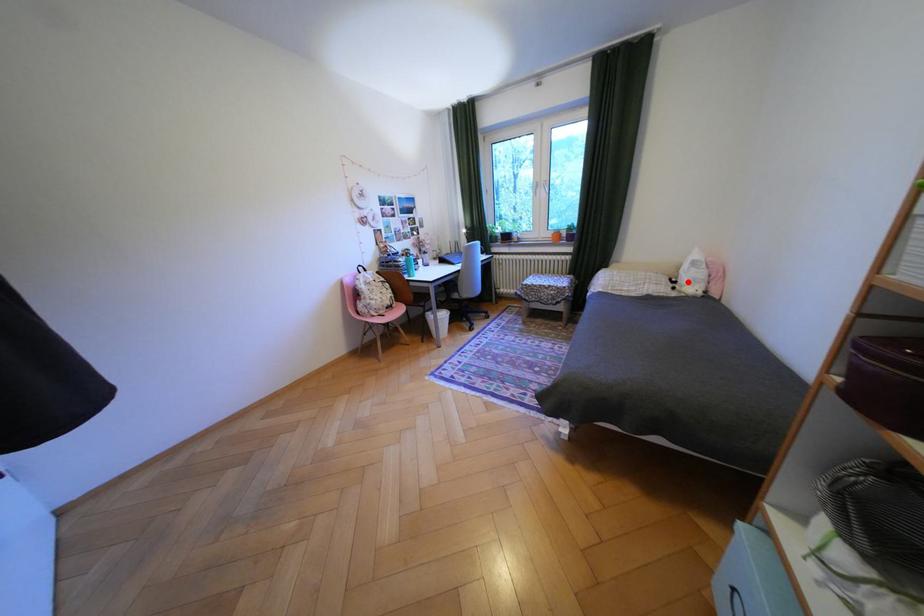
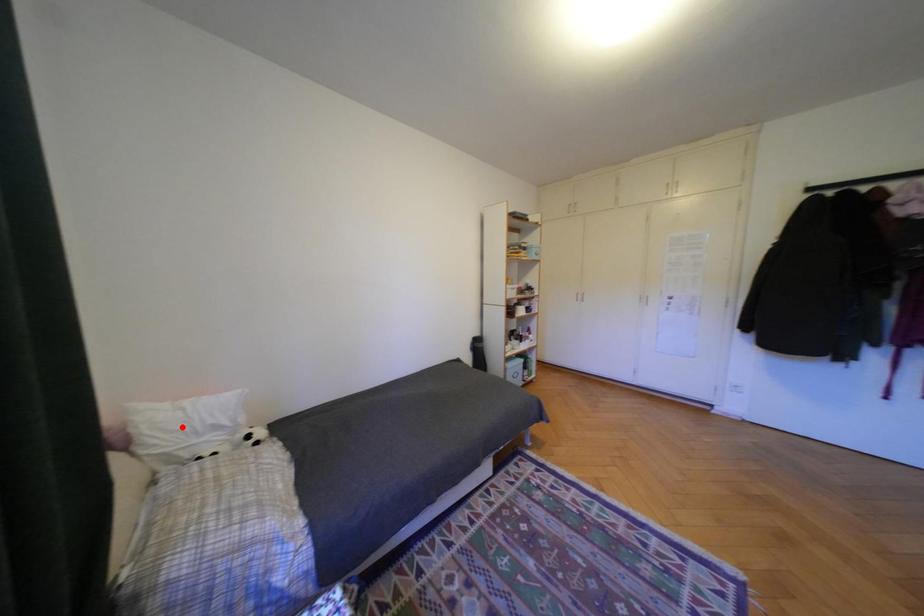
I am providing you with two images of the same scene from different viewpoints. A red point is marked on the first image and another point is marked on the second image. Are the points marked in image1 and image2 representing the same 3D position?

No